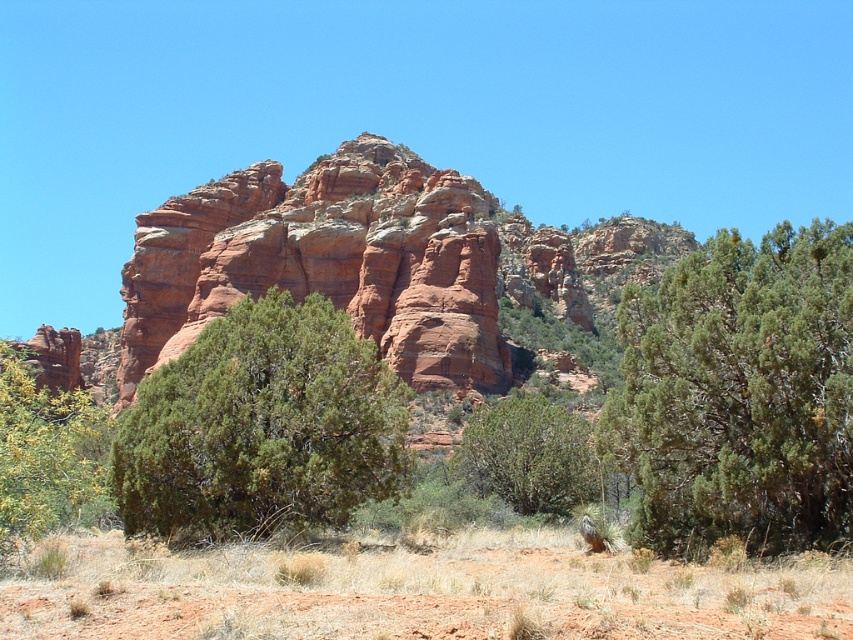
You are a hiker trying to navigate through the landscape. You see the green textured bush at right and the green leafy bush at center. Which one is higher up in the scene?

The green textured bush at right is located above the green leafy bush at center, so it is higher up in the scene.

You are a hiker who wants to know which bush is taller between the green textured bush at right and the green leafy bush at lower left. Can you tell me?

The green textured bush at right is taller than the green leafy bush at lower left according to the description.

Based on the photo, you are a hiker trying to decide which bush to sit under for shade. The scene has a green textured bush at right and a green leafy bush at center. Which one is taller and thus provides more shade?

The green textured bush at right is taller than the green leafy bush at center, so it provides more shade.